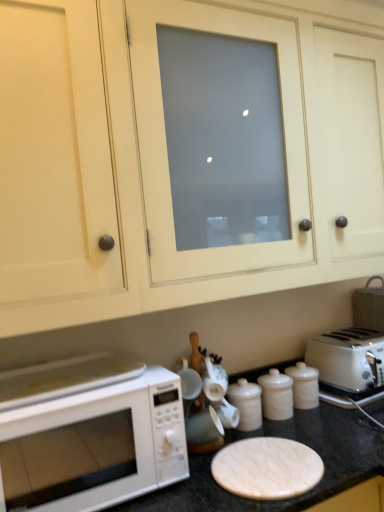
This screenshot has height=512, width=384. What do you see at coordinates (246, 404) in the screenshot?
I see `white glossy canister at center` at bounding box center [246, 404].

What is the approximate height of white matte microwave at lower left?

The height of white matte microwave at lower left is 11.78 inches.

Describe the element at coordinates (174, 167) in the screenshot. I see `white matte cabinet at upper center` at that location.

The width and height of the screenshot is (384, 512). In order to click on white glossy canister at center in this screenshot , I will do `click(246, 404)`.

Does point (100, 249) appear closer or farther from the camera than point (66, 414)?

Clearly, point (100, 249) is more distant from the camera than point (66, 414).

At what (x,y) coordinates should I click in order to perform the action: click on microwave oven located underneath the white matte cabinet at upper center (from a real-world perspective). Please return your answer as a coordinate pair (x, y). Looking at the image, I should click on (94, 446).

From the image's perspective, would you say white matte cabinet at upper center is positioned over white matte microwave at lower left?

→ Yes, from the image's perspective, white matte cabinet at upper center is over white matte microwave at lower left.

From a real-world perspective, is white matte cabinet at upper center positioned over white matte microwave at lower left based on gravity?

Yes, from a real-world perspective, white matte cabinet at upper center is above white matte microwave at lower left.

Looking at this image, from the image's perspective, is white plastic toaster at right located above white glossy canister at center?

Yes, from the image's perspective, white plastic toaster at right is over white glossy canister at center.

Considering the relative sizes of white plastic toaster at right and white glossy canister at center in the image provided, is white plastic toaster at right shorter than white glossy canister at center?

In fact, white plastic toaster at right may be taller than white glossy canister at center.

Is white plastic toaster at right located outside white glossy canister at center?

white plastic toaster at right lies outside white glossy canister at center's area.

Is white marble counter top at lower center oriented away from white glossy canister at center?

No, white marble counter top at lower center is not facing the opposite direction of white glossy canister at center.

Between white marble counter top at lower center and white glossy canister at center, which one has smaller size?

Smaller between the two is white glossy canister at center.

Considering the positions of objects white marble counter top at lower center and white glossy canister at center in the image provided, who is more to the left, white marble counter top at lower center or white glossy canister at center?

From the viewer's perspective, white marble counter top at lower center appears more on the left side.

Considering the relative positions of white marble counter top at lower center and white glossy canister at center in the image provided, is white marble counter top at lower center behind white glossy canister at center?

No, it is in front of white glossy canister at center.

Is point (250, 378) closer to viewer compared to point (191, 232)?

No, (250, 378) is further to viewer.

Looking at the image, does white marble counter top at lower center seem bigger or smaller compared to white matte cabinet at upper center?

Clearly, white marble counter top at lower center is smaller in size than white matte cabinet at upper center.

Identify the location of counter top located below the white matte cabinet at upper center (from the image's perspective). (289, 438).

From the image's perspective, is white marble counter top at lower center below white matte cabinet at upper center?

Correct, white marble counter top at lower center appears lower than white matte cabinet at upper center in the image.

From a real-world perspective, is white matte cabinet at upper center located higher than white plastic toaster at right?

Correct, in the physical world, white matte cabinet at upper center is higher than white plastic toaster at right.

Which is correct: white matte cabinet at upper center is inside white plastic toaster at right, or outside of it?

white matte cabinet at upper center exists outside the volume of white plastic toaster at right.

Can you confirm if white matte cabinet at upper center is smaller than white plastic toaster at right?

No, white matte cabinet at upper center is not smaller than white plastic toaster at right.

Does white plastic toaster at right appear on the left side of white matte microwave at lower left?

No.

Can you confirm if white plastic toaster at right is taller than white matte microwave at lower left?

No.

This screenshot has width=384, height=512. I want to click on toaster on the right side of white matte microwave at lower left, so click(348, 359).

Is white plastic toaster at right oriented towards white matte microwave at lower left?

No.

Is white matte microwave at lower left next to white marble counter top at lower center and touching it?

No.

Is white matte microwave at lower left wider or thinner than white marble counter top at lower center?

In the image, white matte microwave at lower left appears to be more narrow than white marble counter top at lower center.

Is white matte microwave at lower left spatially inside white marble counter top at lower center, or outside of it?

white matte microwave at lower left fits inside white marble counter top at lower center.

Image resolution: width=384 pixels, height=512 pixels. I want to click on microwave oven behind the white matte cabinet at upper center, so click(x=94, y=446).

Identify the location of appliance located below the white plastic toaster at right (from the image's perspective). This screenshot has height=512, width=384. (246, 404).

In the scene shown: Based on their spatial positions, is white plastic toaster at right or white matte cabinet at upper center further from white glossy canister at center?

The object further to white glossy canister at center is white matte cabinet at upper center.

When comparing their distances from white plastic toaster at right, does white glossy canister at center or white matte microwave at lower left seem closer?

white glossy canister at center is positioned closer to the anchor white plastic toaster at right.

Based on their spatial positions, is white marble counter top at lower center or white matte microwave at lower left further from white matte cabinet at upper center?

white marble counter top at lower center.

Estimate the real-world distances between objects in this image. Which object is closer to white glossy canister at center, white matte microwave at lower left or white matte cabinet at upper center?

white matte microwave at lower left.

From the image, which object appears to be farther from white matte microwave at lower left, white marble counter top at lower center or white matte cabinet at upper center?

The object further to white matte microwave at lower left is white matte cabinet at upper center.

Estimate the real-world distances between objects in this image. Which object is closer to white marble counter top at lower center, white matte microwave at lower left or white glossy canister at center?

white glossy canister at center.

From the image, which object appears to be nearer to white matte microwave at lower left, white glossy canister at center or white marble counter top at lower center?

white marble counter top at lower center lies closer to white matte microwave at lower left than the other object.

When comparing their distances from white plastic toaster at right, does white matte cabinet at upper center or white glossy canister at center seem further?

Based on the image, white matte cabinet at upper center appears to be further to white plastic toaster at right.

Image resolution: width=384 pixels, height=512 pixels. In order to click on microwave oven between white matte cabinet at upper center and white glossy canister at center in the vertical direction in this screenshot , I will do `click(94, 446)`.

You are a GUI agent. You are given a task and a screenshot of the screen. Output one action in this format:
    pyautogui.click(x=<x>, y=<y>)
    Task: Click on the microwave oven between white matte cabinet at upper center and white marble counter top at lower center vertically
    The image size is (384, 512).
    Given the screenshot: What is the action you would take?
    pyautogui.click(x=94, y=446)

At what (x,y) coordinates should I click in order to perform the action: click on cabinetry between white matte microwave at lower left and white plastic toaster at right. Please return your answer as a coordinate pair (x, y). The width and height of the screenshot is (384, 512). Looking at the image, I should click on (174, 167).

The image size is (384, 512). Identify the location of appliance between white matte cabinet at upper center and white marble counter top at lower center from top to bottom. (246, 404).